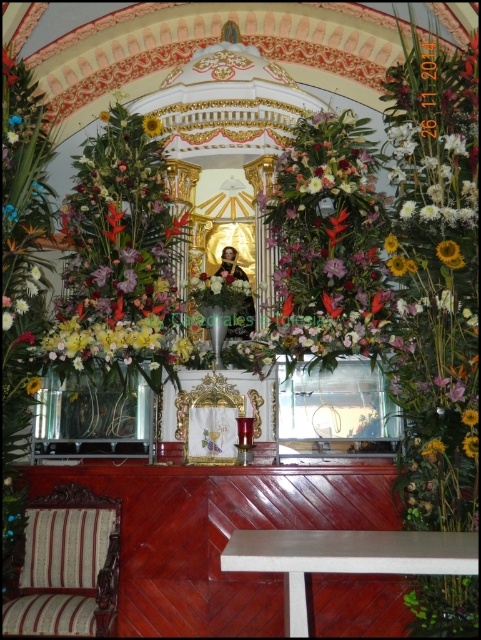
You are an interior designer planning to place a new candle holder at coordinate point 0.4, 0.9. Will the yellow matte sunflower at upper center interfere with this placement?

The yellow matte sunflower at upper center is located at point (x=447, y=250), which is very close to the desired coordinate point (x=432, y=256). Therefore, placing the candle holder there may interfere with the sunflower.

You are a florist who needs to adjust the floral arrangement on the altar. The floral bouquet at center and the yellow matte sunflower at center are both present. Which one is taller?

The floral bouquet at center is taller than the yellow matte sunflower at center according to the description.

You are standing in front of the altar and want to place a small candle on the small table with a white cloth in front of the altar. The candle is 10 centimeters tall. Can the candle be placed there without blocking the view of the yellow matte sunflower at upper center?

The yellow matte sunflower at upper center and viewer are 41.24 meters apart from each other. Since the candle is only 10 centimeters tall, it would not obstruct the view of the sunflower from that distance. Therefore, the candle can be placed on the small table without blocking the view.